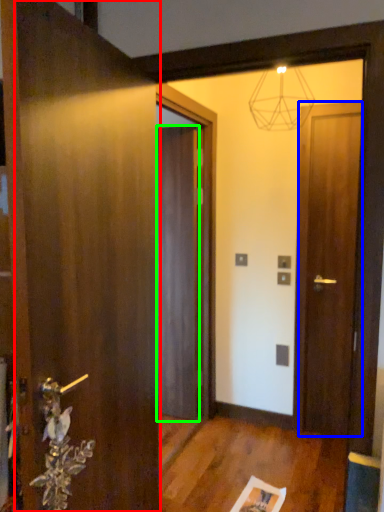
Question: Considering the real-world distances, which object is closest to door (highlighted by a red box)? door (highlighted by a blue box) or door (highlighted by a green box).

Choices:
 (A) door
 (B) door

Answer: (B)